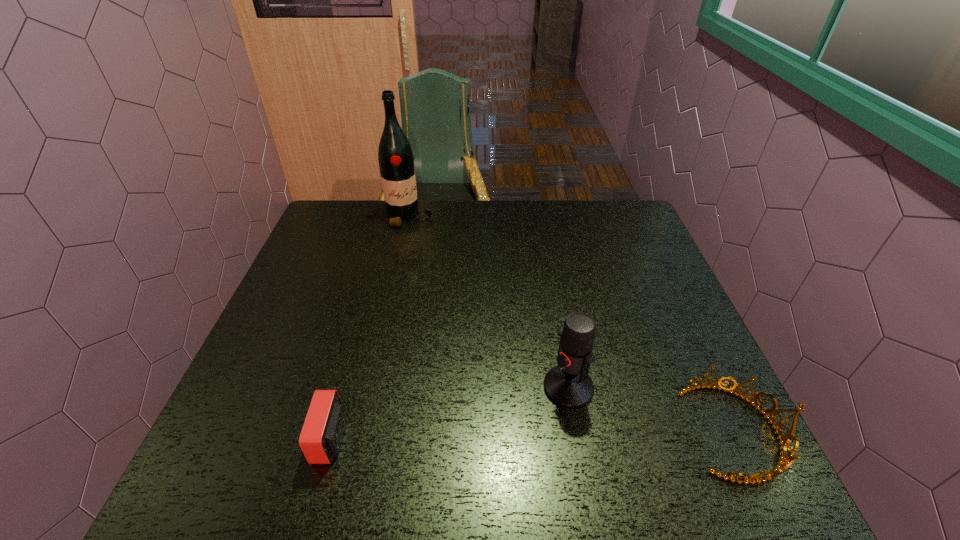
Locate an element on the screen. vacant spot on the desktop that is between the alarm clock and the tiara and is positioned on the surface of the wine bottle is located at coordinates (545, 435).

This screenshot has height=540, width=960. Identify the location of vacant space on the desktop that is between the alarm clock and the rightmost object and is positioned on the side of the third object from left to right with the red ring. (491, 436).